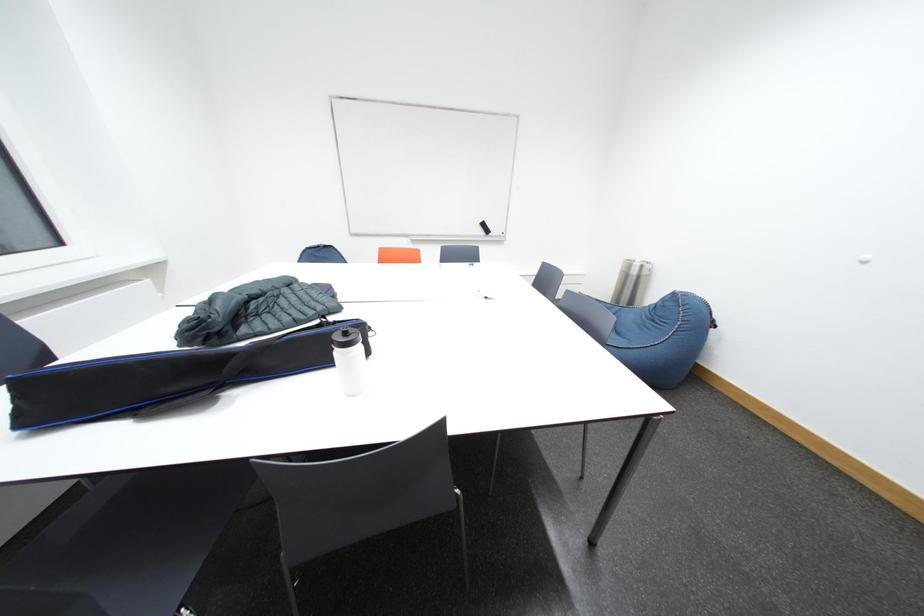
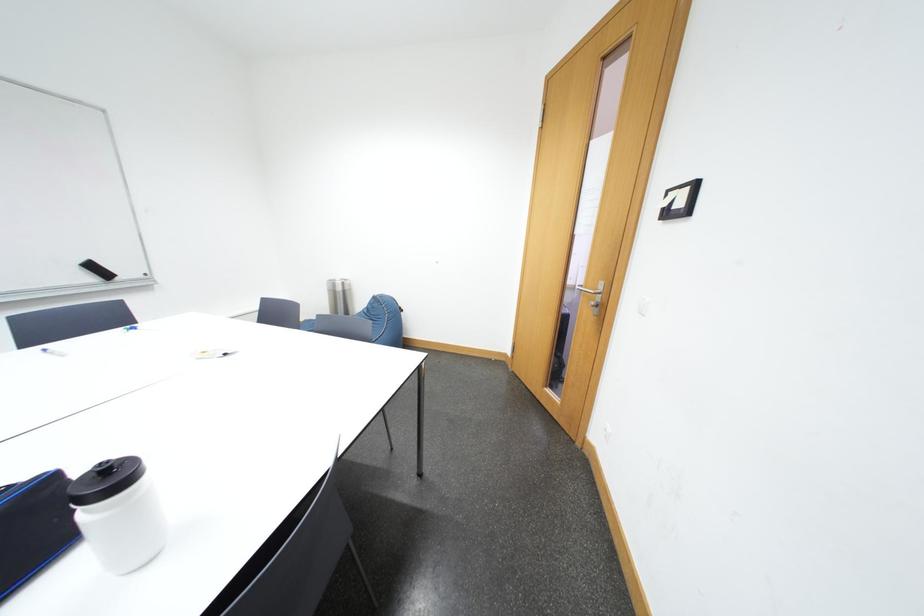
Question: How did the camera likely rotate?

Choices:
 (A) Left
 (B) Right
 (C) Up
 (D) Down

Answer: (B)